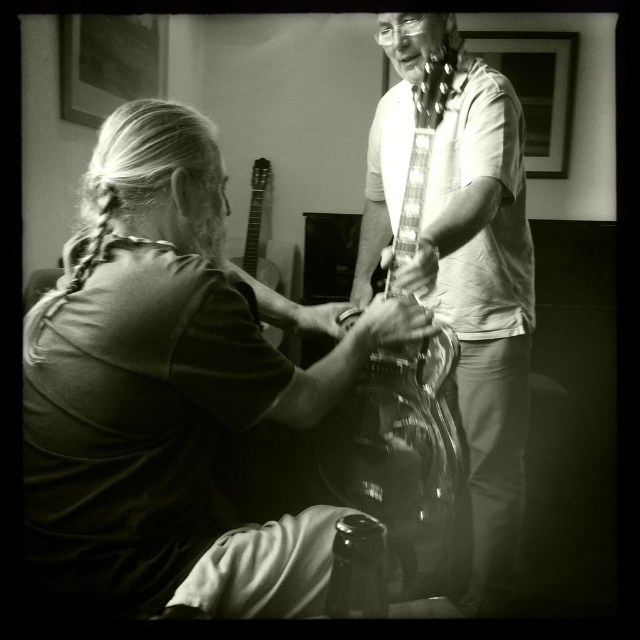
Which is below, glossy wood guitar at center or translucent glass bottle at lower center?

Positioned lower is translucent glass bottle at lower center.

Between point (433, 180) and point (356, 577), which one is positioned in front?

Point (356, 577)

Where is `glossy wood guitar at center`? The width and height of the screenshot is (640, 640). glossy wood guitar at center is located at coordinates coord(483,301).

Looking at this image, is smooth leather guitar at center taller than acoustic wood guitar at upper center?

Yes.

Which is behind, point (74, 420) or point (268, 164)?

Point (268, 164)

At what (x,y) coordinates should I click in order to perform the action: click on smooth leather guitar at center. Please return your answer as a coordinate pair (x, y). Looking at the image, I should click on [170, 392].

Does smooth leather guitar at center come behind translucent glass bottle at lower center?

Yes, smooth leather guitar at center is behind translucent glass bottle at lower center.

Consider the image. Can you confirm if smooth leather guitar at center is bigger than translucent glass bottle at lower center?

Correct, smooth leather guitar at center is larger in size than translucent glass bottle at lower center.

Image resolution: width=640 pixels, height=640 pixels. I want to click on smooth leather guitar at center, so click(170, 392).